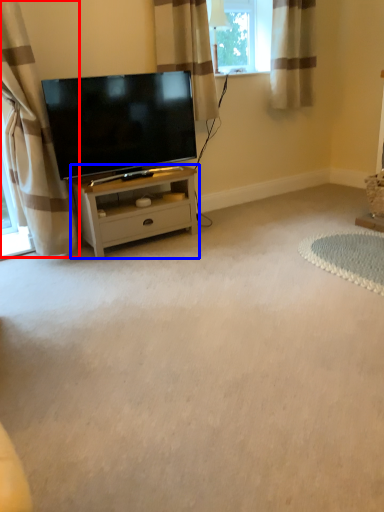
Question: Which object appears farthest to the camera in this image, curtain (highlighted by a red box) or nightstand (highlighted by a blue box)?

Choices:
 (A) curtain
 (B) nightstand

Answer: (B)